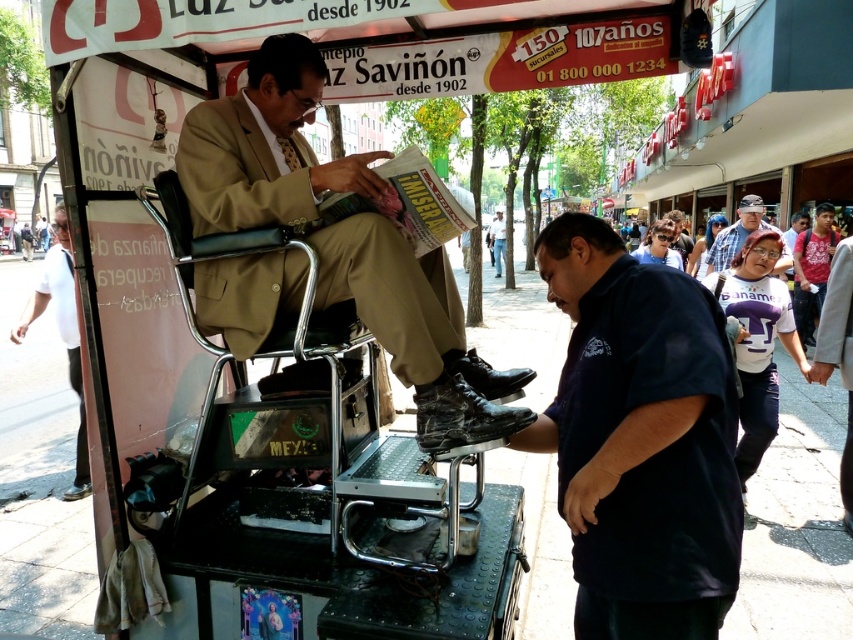
Question: Is matte brown suit at center below light brown leather shoes at center?

Choices:
 (A) no
 (B) yes

Answer: (B)

Question: Does dark blue shirt at center appear on the right side of white shirt at left?

Choices:
 (A) no
 (B) yes

Answer: (B)

Question: Which of the following is the farthest from the observer?

Choices:
 (A) (500, 234)
 (B) (720, 321)
 (C) (409, 262)

Answer: (A)

Question: Which point is closer to the camera?

Choices:
 (A) blue denim shirt at center
 (B) white shirt at left

Answer: (B)

Question: Is dark blue shirt at center to the left of light brown leather shoes at center from the viewer's perspective?

Choices:
 (A) yes
 (B) no

Answer: (A)

Question: Based on their relative distances, which object is nearer to the blue denim shirt at center?

Choices:
 (A) light brown leather shoes at center
 (B) matte brown suit at center
 (C) dark blue shirt at center

Answer: (B)